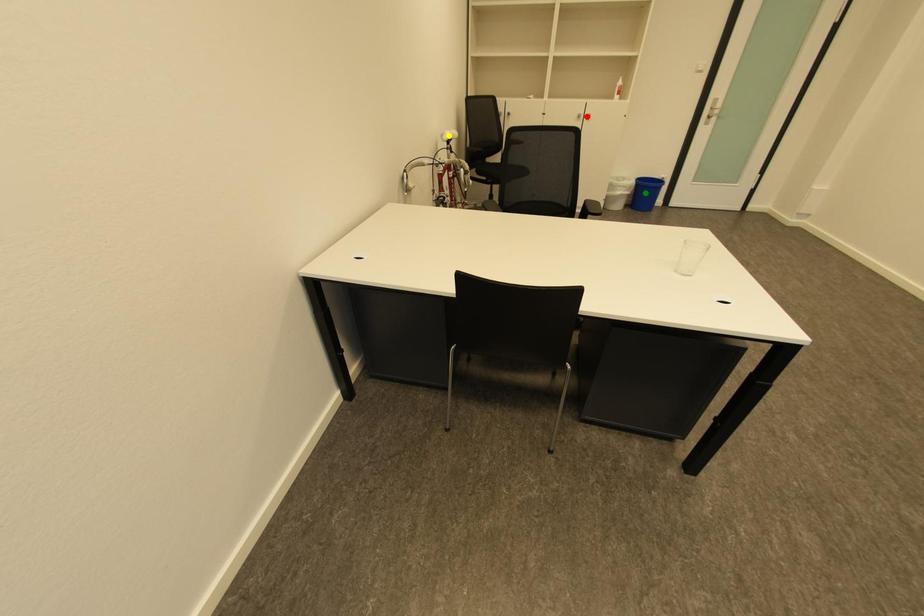
Order these from nearest to farthest:
1. red point
2. yellow point
3. green point

1. red point
2. yellow point
3. green point